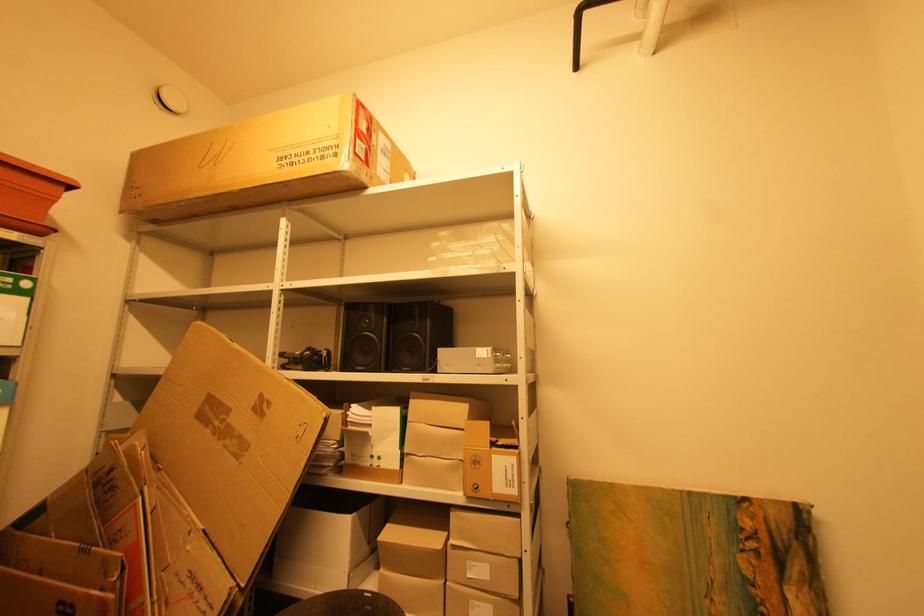
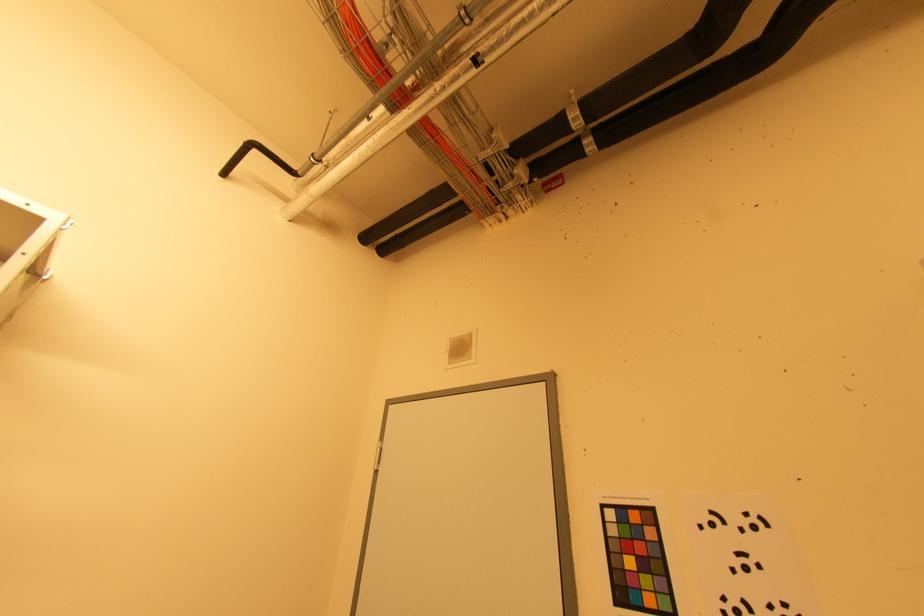
First-person continuous shooting, in which direction is the camera rotating?

The camera rotated toward right-up.